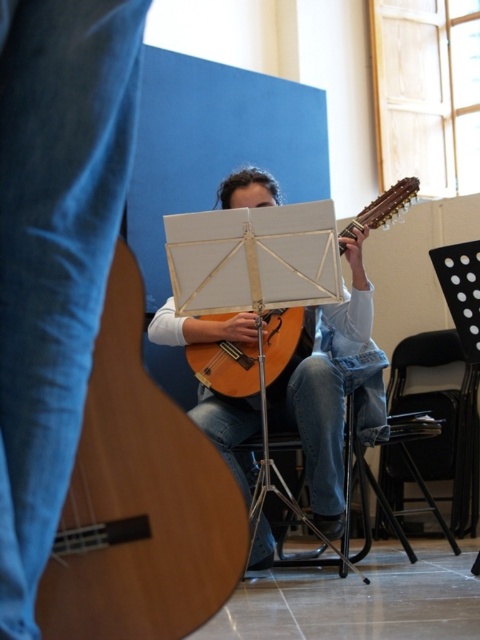
Question: Does matte white music stand at center have a lesser width compared to black plastic chair at lower center?

Choices:
 (A) yes
 (B) no

Answer: (B)

Question: Can you confirm if light brown wooden guitar at center is positioned to the left of matte white music stand at center?

Choices:
 (A) yes
 (B) no

Answer: (A)

Question: Which of these objects is positioned farthest from the matte white music stand at center?

Choices:
 (A) light brown wooden guitar at center
 (B) denim jeans at lower left
 (C) black plastic chair at lower center

Answer: (B)

Question: Considering the real-world distances, which object is farthest from the denim jeans at lower left?

Choices:
 (A) light brown wooden guitar at center
 (B) matte white music stand at center
 (C) wooden acoustic guitar at center

Answer: (B)

Question: Which object is positioned farthest from the matte white music stand at center?

Choices:
 (A) denim jeans at lower left
 (B) black plastic chair at lower center
 (C) light brown wooden guitar at center
 (D) black plastic chair at lower right

Answer: (A)

Question: Can you confirm if black plastic chair at lower right is positioned below black plastic chair at lower center?

Choices:
 (A) no
 (B) yes

Answer: (A)